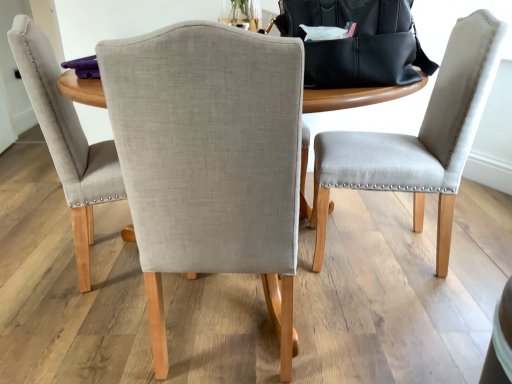
The height and width of the screenshot is (384, 512). Identify the location of free space in front of matte gray chair at right, which ranks as the third chair in left-to-right order. (x=395, y=322).